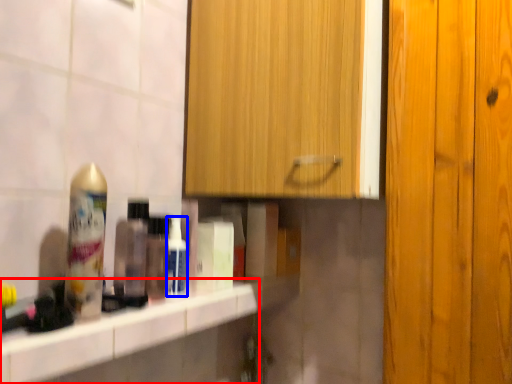
Question: Which of the following is the closest to the observer, counter top (highlighted by a red box) or mouthwash (highlighted by a blue box)?

Choices:
 (A) counter top
 (B) mouthwash

Answer: (A)